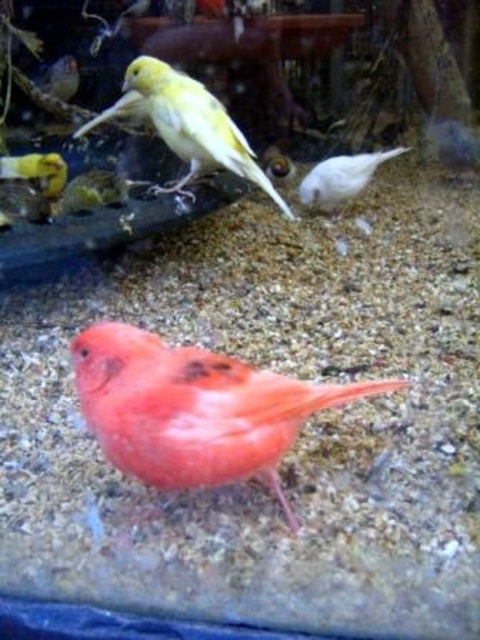
You are standing in front of the birdcage and notice two points inside it. The first point is at coordinates point (242, 364) and the second is at point (312, 179). Which point is nearer to you?

Point (242, 364) is closer to the viewer than point (312, 179).

You are a zookeeper who needs to feed the matte orange bird at center and the yellow matte canary at upper center. The feeding tool you have can reach up to 30 inches. Can you feed both birds without moving the tool?

The matte orange bird at center and the yellow matte canary at upper center are 34.30 inches apart from each other. Since the feeding tool can only reach up to 30 inches, you cannot feed both birds without moving the tool because the distance exceeds the tool reach.

You are a bird enthusiast observing the birdcage. You notice the matte orange bird at center and the white matte bird at center. Which bird would cast a shorter shadow if the light source is directly above them?

The matte orange bird at center has a smaller size compared to the white matte bird at center, so it would cast a shorter shadow.